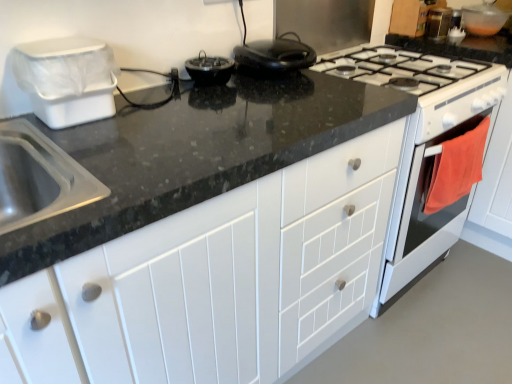
At what (x,y) coordinates should I click in order to perform the action: click on white plastic bin at left, placed as the 1th appliance when sorted from front to back. Please return your answer as a coordinate pair (x, y). Looking at the image, I should click on (67, 79).

Where is `metallic silver toaster at upper right, which is the second appliance from back to front`? This screenshot has height=384, width=512. metallic silver toaster at upper right, which is the second appliance from back to front is located at coordinates (438, 22).

The height and width of the screenshot is (384, 512). I want to click on white glossy gas stove at upper right, so click(x=423, y=82).

What is the approximate width of white matte cabinet at center?

It is 25.28 inches.

Describe the element at coordinates (428, 214) in the screenshot. I see `orange fabric oven at right, placed as the 2th oven when sorted from back to front` at that location.

Where is `white glossy oven at right, which appears as the 2th oven when viewed from the front`? This screenshot has height=384, width=512. white glossy oven at right, which appears as the 2th oven when viewed from the front is located at coordinates (423, 186).

What do you see at coordinates (483, 19) in the screenshot? I see `transparent plastic bowl at upper right, which is counted as the first appliance, starting from the back` at bounding box center [483, 19].

I want to click on white plastic bin at left, which appears as the 3th appliance when viewed from the top, so click(67, 79).

Does white plastic bin at left, placed as the 1th appliance when sorted from front to back, turn towards transparent plastic bowl at upper right, the third appliance when ordered from left to right?

No, white plastic bin at left, placed as the 1th appliance when sorted from front to back, is not turned towards transparent plastic bowl at upper right, the third appliance when ordered from left to right.

From the image's perspective, between white plastic bin at left, the first appliance in the bottom-to-top sequence, and transparent plastic bowl at upper right, which is counted as the first appliance, starting from the back, which one is located above?

From the image's view, transparent plastic bowl at upper right, which is counted as the first appliance, starting from the back, is above.

Is white plastic bin at left, which appears as the 3th appliance when viewed from the top, touching transparent plastic bowl at upper right, placed as the third appliance when sorted from front to back?

white plastic bin at left, which appears as the 3th appliance when viewed from the top, is not next to transparent plastic bowl at upper right, placed as the third appliance when sorted from front to back, and they're not touching.

Are metallic silver toaster at upper right, marked as the 2th appliance in a front-to-back arrangement, and white plastic bin at left, which appears as the 3th appliance when viewed from the top, beside each other?

No, metallic silver toaster at upper right, marked as the 2th appliance in a front-to-back arrangement, is not next to white plastic bin at left, which appears as the 3th appliance when viewed from the top.

Between metallic silver toaster at upper right, arranged as the 2th appliance when viewed from the right, and white plastic bin at left, which appears as the 3th appliance when viewed from the top, which one has more height?

white plastic bin at left, which appears as the 3th appliance when viewed from the top.

From the image's perspective, who appears lower, metallic silver toaster at upper right, the second appliance in the top-to-bottom sequence, or white plastic bin at left, the first appliance when ordered from left to right?

white plastic bin at left, the first appliance when ordered from left to right, from the image's perspective.

Consider the image. What's the angular difference between metallic silver toaster at upper right, which is the second appliance from back to front, and white plastic bin at left, the first appliance when ordered from left to right,'s facing directions?

The facing directions of metallic silver toaster at upper right, which is the second appliance from back to front, and white plastic bin at left, the first appliance when ordered from left to right, are 90 degrees apart.

Considering the relative positions of metallic silver toaster at upper right, arranged as the 2th appliance when viewed from the right, and white glossy oven at right, the first oven viewed from the back, in the image provided, is metallic silver toaster at upper right, arranged as the 2th appliance when viewed from the right, to the right of white glossy oven at right, the first oven viewed from the back, from the viewer's perspective?

No.

Would you consider metallic silver toaster at upper right, which is the second appliance from back to front, to be distant from white glossy oven at right, which appears as the 2th oven when viewed from the front?

Actually, metallic silver toaster at upper right, which is the second appliance from back to front, and white glossy oven at right, which appears as the 2th oven when viewed from the front, are a little close together.

Can you confirm if metallic silver toaster at upper right, marked as the 2th appliance in a front-to-back arrangement, is bigger than white glossy oven at right, the first oven viewed from the back?

No, metallic silver toaster at upper right, marked as the 2th appliance in a front-to-back arrangement, is not bigger than white glossy oven at right, the first oven viewed from the back.

Between metallic silver toaster at upper right, marked as the 2th appliance in a front-to-back arrangement, and white glossy oven at right, which appears as the 2th oven when viewed from the front, which one has more height?

Standing taller between the two is white glossy oven at right, which appears as the 2th oven when viewed from the front.

Considering the relative sizes of white matte cabinet at center and transparent plastic bowl at upper right, the 1th appliance from the top, in the image provided, is white matte cabinet at center shorter than transparent plastic bowl at upper right, the 1th appliance from the top,?

No.

Measure the distance between white matte cabinet at center and transparent plastic bowl at upper right, the third appliance when ordered from left to right.

white matte cabinet at center and transparent plastic bowl at upper right, the third appliance when ordered from left to right, are 1.67 meters apart.

Does white matte cabinet at center appear on the left side of transparent plastic bowl at upper right, which is counted as the first appliance, starting from the back?

Yes, white matte cabinet at center is to the left of transparent plastic bowl at upper right, which is counted as the first appliance, starting from the back.

Is white matte cabinet at center wider than transparent plastic bowl at upper right, the third appliance from the bottom?

Correct, the width of white matte cabinet at center exceeds that of transparent plastic bowl at upper right, the third appliance from the bottom.

From the image's perspective, relative to white glossy gas stove at upper right, is orange fabric oven at right, placed as the 2th oven when sorted from back to front, above or below?

Clearly, from the image's perspective, orange fabric oven at right, placed as the 2th oven when sorted from back to front, is below white glossy gas stove at upper right.

From their relative heights in the image, would you say orange fabric oven at right, placed as the 2th oven when sorted from back to front, is taller or shorter than white glossy gas stove at upper right?

Clearly, orange fabric oven at right, placed as the 2th oven when sorted from back to front, is taller compared to white glossy gas stove at upper right.

Is white glossy gas stove at upper right at the back of orange fabric oven at right, placed as the 2th oven when sorted from back to front?

Yes, orange fabric oven at right, placed as the 2th oven when sorted from back to front, is facing away from white glossy gas stove at upper right.

Is orange fabric oven at right, marked as the 1th oven in a front-to-back arrangement, outside of white glossy gas stove at upper right?

Yes, orange fabric oven at right, marked as the 1th oven in a front-to-back arrangement, is located beyond the bounds of white glossy gas stove at upper right.

Based on the photo, from the image's perspective, does white glossy gas stove at upper right appear higher than white glossy oven at right, the first oven viewed from the back?

Yes.

From a real-world perspective, is white glossy gas stove at upper right above or below white glossy oven at right, the first oven viewed from the back?

From a real-world perspective, white glossy gas stove at upper right is physically above white glossy oven at right, the first oven viewed from the back.

Which of these two, white glossy gas stove at upper right or white glossy oven at right, the first oven viewed from the back, is wider?

Wider between the two is white glossy gas stove at upper right.

You are a GUI agent. You are given a task and a screenshot of the screen. Output one action in this format:
    pyautogui.click(x=<x>, y=<y>)
    Task: Click on the 2nd appliance below the transparent plastic bowl at upper right, the 1th appliance from the top (from the image's perspective)
    The height and width of the screenshot is (384, 512).
    Given the screenshot: What is the action you would take?
    tap(67, 79)

How different are the orientations of transparent plastic bowl at upper right, placed as the third appliance when sorted from front to back, and white plastic bin at left, the 3th appliance when ordered from back to front, in degrees?

90 degrees.

From the picture: Considering the relative sizes of transparent plastic bowl at upper right, which is counted as the first appliance, starting from the back, and white plastic bin at left, which appears as the 3th appliance when viewed from the top, in the image provided, is transparent plastic bowl at upper right, which is counted as the first appliance, starting from the back, bigger than white plastic bin at left, which appears as the 3th appliance when viewed from the top,?

No.

Where is `the 2nd appliance in front of the transparent plastic bowl at upper right, the 1th appliance from the top, counting from the anchor's position`? the 2nd appliance in front of the transparent plastic bowl at upper right, the 1th appliance from the top, counting from the anchor's position is located at coordinates (67, 79).

Identify the location of appliance that appears above the metallic silver toaster at upper right, arranged as the 2th appliance when viewed from the right (from a real-world perspective). The width and height of the screenshot is (512, 384). (67, 79).

When comparing their distances from white glossy oven at right, the first oven viewed from the back, does metallic silver toaster at upper right, which is the second appliance from back to front, or white matte cabinet at center seem further?

metallic silver toaster at upper right, which is the second appliance from back to front, is positioned further to the anchor white glossy oven at right, the first oven viewed from the back.

Considering their positions, is orange fabric oven at right, marked as the 1th oven in a front-to-back arrangement, positioned closer to metallic silver toaster at upper right, the second appliance when ordered from bottom to top, than white glossy gas stove at upper right?

white glossy gas stove at upper right lies closer to metallic silver toaster at upper right, the second appliance when ordered from bottom to top, than the other object.

Estimate the real-world distances between objects in this image. Which object is further from white plastic bin at left, placed as the 1th appliance when sorted from front to back, white glossy gas stove at upper right or white glossy oven at right, which appears as the 2th oven when viewed from the front?

The object further to white plastic bin at left, placed as the 1th appliance when sorted from front to back, is white glossy oven at right, which appears as the 2th oven when viewed from the front.

Estimate the real-world distances between objects in this image. Which object is further from white glossy gas stove at upper right, white plastic bin at left, the first appliance in the bottom-to-top sequence, or white matte cabinet at center?

white plastic bin at left, the first appliance in the bottom-to-top sequence, is positioned further to the anchor white glossy gas stove at upper right.

Estimate the real-world distances between objects in this image. Which object is closer to metallic silver toaster at upper right, arranged as the 2th appliance when viewed from the right, white glossy gas stove at upper right or white glossy oven at right, which appears as the 2th oven when viewed from the front?

white glossy gas stove at upper right lies closer to metallic silver toaster at upper right, arranged as the 2th appliance when viewed from the right, than the other object.

Estimate the real-world distances between objects in this image. Which object is closer to orange fabric oven at right, placed as the 2th oven when sorted from back to front, white glossy gas stove at upper right or white plastic bin at left, the third appliance viewed from the right?

The object closer to orange fabric oven at right, placed as the 2th oven when sorted from back to front, is white glossy gas stove at upper right.

Which object lies nearer to the anchor point white glossy oven at right, the first oven viewed from the back, transparent plastic bowl at upper right, which is counted as the first appliance, starting from the back, or white matte cabinet at center?

Among the two, white matte cabinet at center is located nearer to white glossy oven at right, the first oven viewed from the back.

From the image, which object appears to be farther from metallic silver toaster at upper right, which appears as the 2th appliance when viewed from the left, white glossy gas stove at upper right or white plastic bin at left, which appears as the 3th appliance when viewed from the top?

Among the two, white plastic bin at left, which appears as the 3th appliance when viewed from the top, is located further to metallic silver toaster at upper right, which appears as the 2th appliance when viewed from the left.

Find the location of a particular element. The height and width of the screenshot is (384, 512). gas stove situated between white plastic bin at left, the first appliance in the bottom-to-top sequence, and orange fabric oven at right, placed as the 2th oven when sorted from back to front, from left to right is located at coordinates (423, 82).

The width and height of the screenshot is (512, 384). I want to click on cabinetry located between white plastic bin at left, which appears as the 3th appliance when viewed from the top, and metallic silver toaster at upper right, the second appliance in the top-to-bottom sequence, in the left-right direction, so click(215, 281).

Locate an element on the screen. The height and width of the screenshot is (384, 512). cabinetry located between white plastic bin at left, the third appliance viewed from the right, and white glossy gas stove at upper right in the left-right direction is located at coordinates (215, 281).

The height and width of the screenshot is (384, 512). Identify the location of oven between white glossy gas stove at upper right and white glossy oven at right, the first oven viewed from the back, in the horizontal direction. (428, 214).